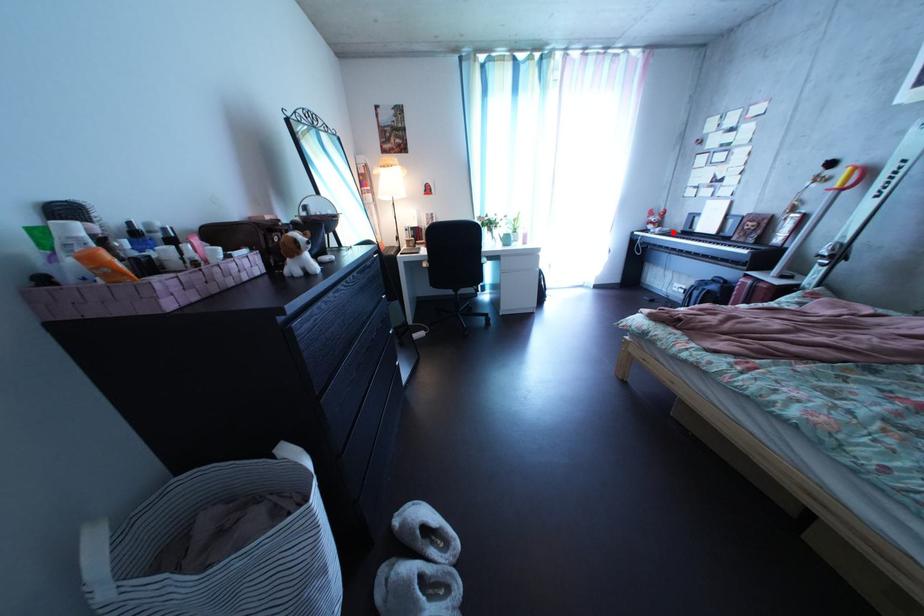
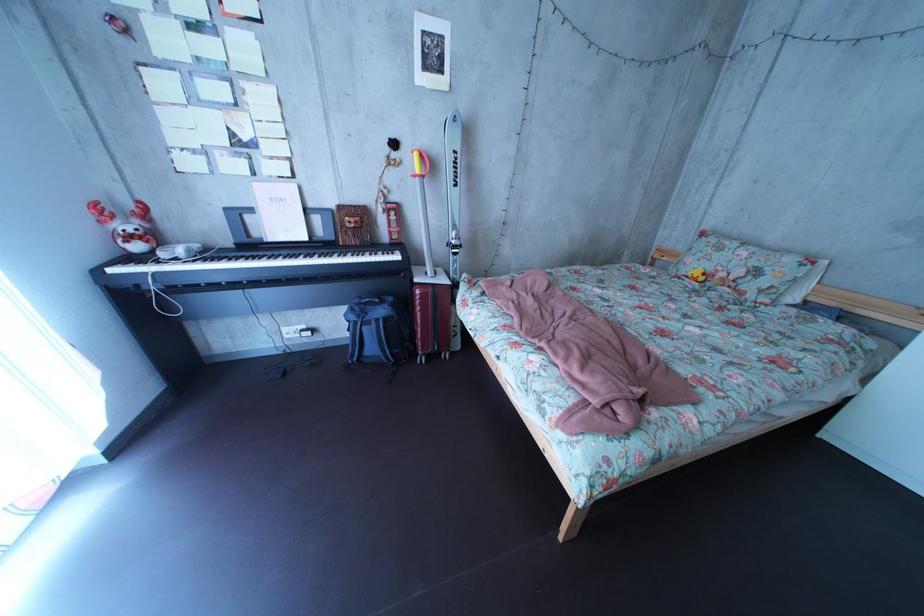
The point at the highlighted location is marked in the first image. Where is the corresponding point in the second image?

(169, 246)